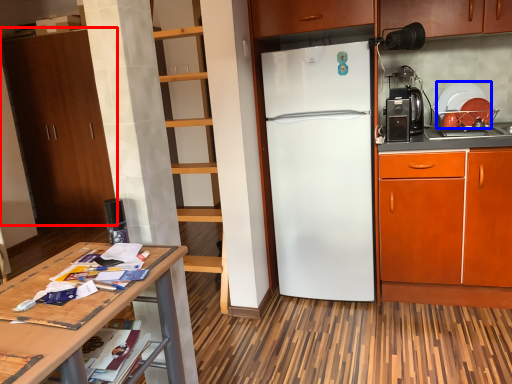
Question: Which of the following is the farthest to the observer, cabinetry (highlighted by a red box) or appliance (highlighted by a blue box)?

Choices:
 (A) cabinetry
 (B) appliance

Answer: (A)